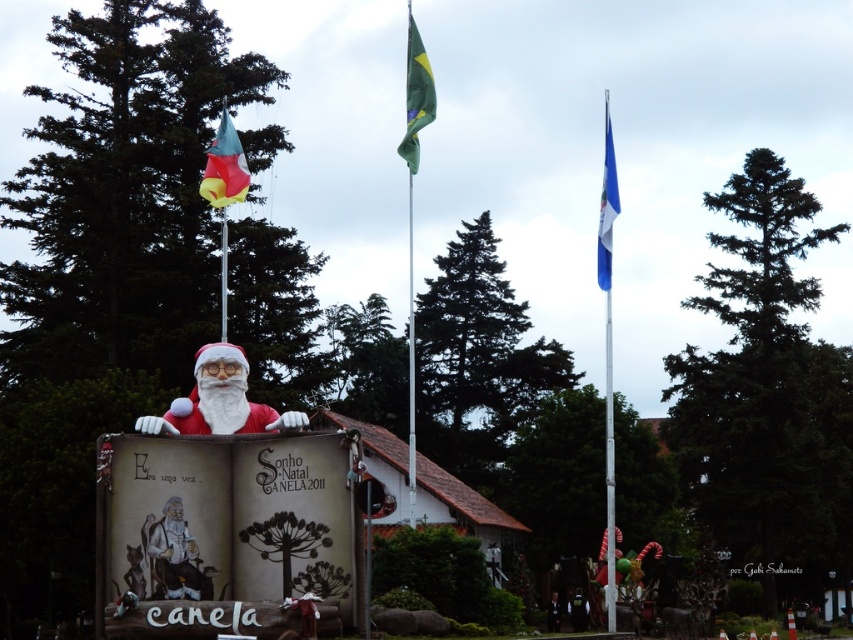
Question: Which of the following is the closest to the observer?

Choices:
 (A) white metallic flag pole at right
 (B) matte plastic flag at upper left
 (C) green fabric flag at upper center
 (D) blue fabric flag at upper right

Answer: (B)

Question: Among these points, which one is farthest from the camera?

Choices:
 (A) (235, 355)
 (B) (616, 541)

Answer: (B)

Question: Does matte red santa at center appear over blue fabric flag at right?

Choices:
 (A) yes
 (B) no

Answer: (A)

Question: Is matte plastic flag at upper left above blue fabric flag at upper right?

Choices:
 (A) yes
 (B) no

Answer: (A)

Question: Does matte red santa at center appear on the left side of blue fabric flag at right?

Choices:
 (A) yes
 (B) no

Answer: (A)

Question: Among these objects, which one is nearest to the camera?

Choices:
 (A) green fabric flag at upper center
 (B) blue fabric flag at right
 (C) matte red santa at center
 (D) blue fabric flag at upper right

Answer: (C)